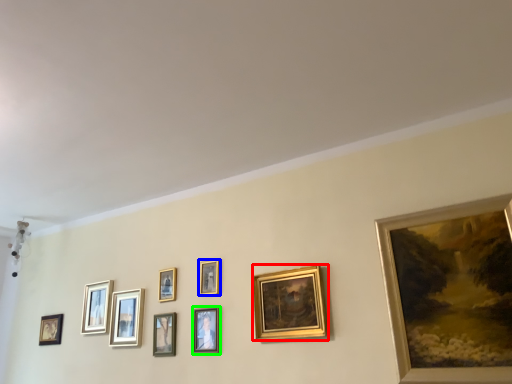
Question: Which object is the closest to the picture frame (highlighted by a red box)? Choose among these: picture frame (highlighted by a blue box) or picture frame (highlighted by a green box).

Choices:
 (A) picture frame
 (B) picture frame

Answer: (B)